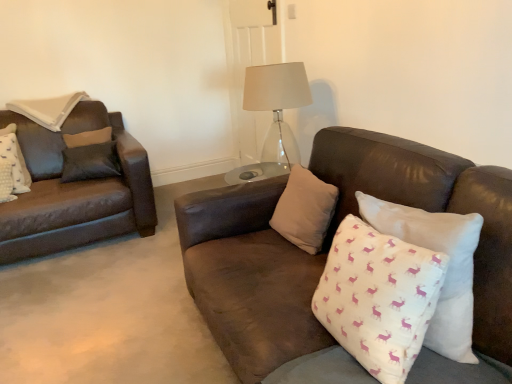
Question: Which direction should I rotate to face white cotton pillow with pink deer pattern at center, the fourth pillow from the left, — up or down?

Choices:
 (A) down
 (B) up

Answer: (A)

Question: Which direction should I rotate to look at beige fabric pillow at center, acting as the 3th pillow starting from the right, — up or down?

Choices:
 (A) up
 (B) down

Answer: (B)

Question: Is transparent glass table lamp at center positioned behind white cotton cushion with pink deer pattern at right, which is the third pillow in left-to-right order?

Choices:
 (A) no
 (B) yes

Answer: (B)

Question: Does transparent glass table lamp at center have a lesser height compared to white cotton cushion with pink deer pattern at right, placed as the second pillow when sorted from right to left?

Choices:
 (A) yes
 (B) no

Answer: (B)

Question: From a real-world perspective, is transparent glass table lamp at center physically above white cotton cushion with pink deer pattern at right, which is the third pillow in left-to-right order?

Choices:
 (A) yes
 (B) no

Answer: (A)

Question: Is transparent glass table lamp at center in front of white cotton cushion with pink deer pattern at right, which is the third pillow in left-to-right order?

Choices:
 (A) yes
 (B) no

Answer: (B)

Question: Is transparent glass table lamp at center not near white cotton cushion with pink deer pattern at right, which is the third pillow in left-to-right order?

Choices:
 (A) no
 (B) yes

Answer: (B)

Question: Can we say transparent glass table lamp at center lies outside white cotton cushion with pink deer pattern at right, placed as the second pillow when sorted from right to left?

Choices:
 (A) yes
 (B) no

Answer: (A)

Question: Is there a large distance between beige fabric pillow at center, acting as the 3th pillow starting from the right, and white cotton pillow with pink deer pattern at center, the fourth pillow from the left?

Choices:
 (A) yes
 (B) no

Answer: (B)

Question: Considering the relative sizes of beige fabric pillow at center, acting as the 3th pillow starting from the right, and white cotton pillow with pink deer pattern at center, arranged as the 1th pillow when viewed from the right, in the image provided, is beige fabric pillow at center, acting as the 3th pillow starting from the right, taller than white cotton pillow with pink deer pattern at center, arranged as the 1th pillow when viewed from the right,?

Choices:
 (A) yes
 (B) no

Answer: (B)

Question: Is beige fabric pillow at center, the second pillow from the left, thinner than white cotton pillow with pink deer pattern at center, arranged as the 1th pillow when viewed from the right?

Choices:
 (A) no
 (B) yes

Answer: (A)

Question: Is beige fabric pillow at center, the second pillow from the left, wider than white cotton pillow with pink deer pattern at center, the fourth pillow from the left?

Choices:
 (A) yes
 (B) no

Answer: (A)

Question: Is white cotton pillow with pink deer pattern at center, the fourth pillow from the left, a part of beige fabric pillow at center, acting as the 3th pillow starting from the right?

Choices:
 (A) yes
 (B) no

Answer: (B)

Question: From a real-world perspective, is beige fabric pillow at center, the second pillow from the left, below white cotton pillow with pink deer pattern at center, the fourth pillow from the left?

Choices:
 (A) no
 (B) yes

Answer: (B)

Question: Is transparent glass table lamp at center surrounded by white cotton pillow with pink deer pattern at center, arranged as the 1th pillow when viewed from the right?

Choices:
 (A) no
 (B) yes

Answer: (A)